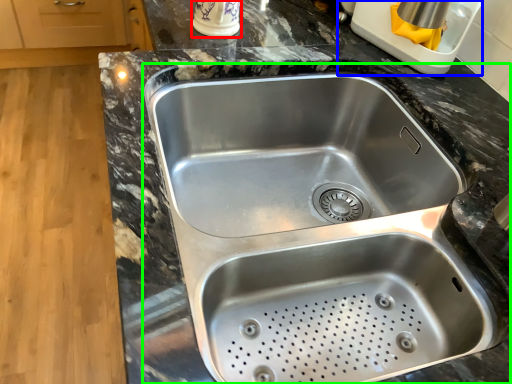
Question: Estimate the real-world distances between objects in this image. Which object is farther from appliance (highlighted by a red box), appliance (highlighted by a blue box) or sink (highlighted by a green box)?

Choices:
 (A) appliance
 (B) sink

Answer: (B)